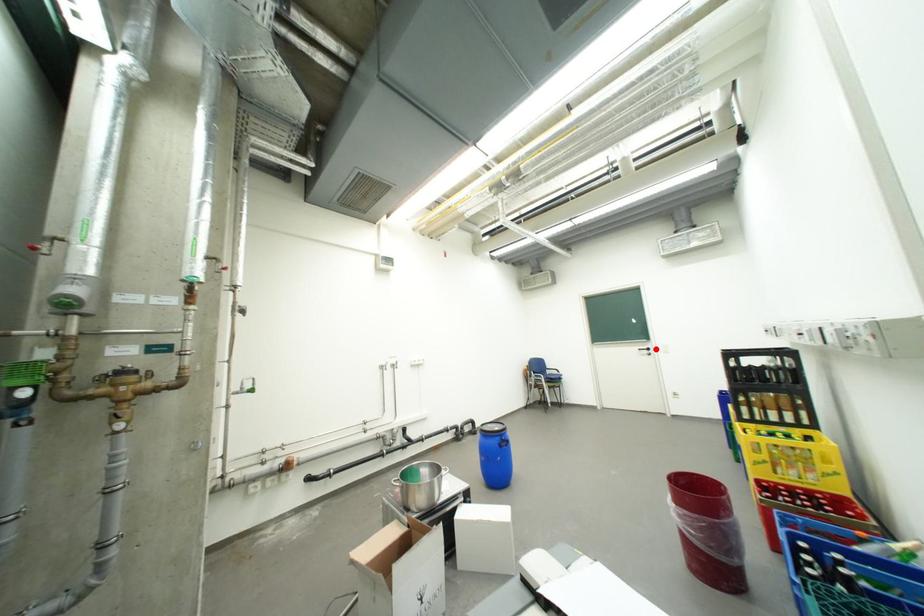
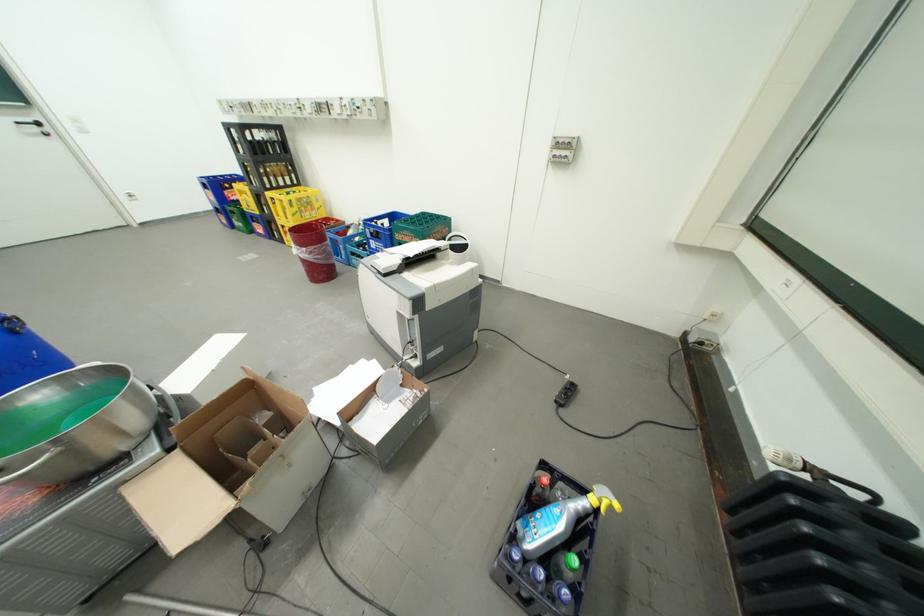
Find the pixel in the second image that matches the highlighted location in the first image.

(41, 122)